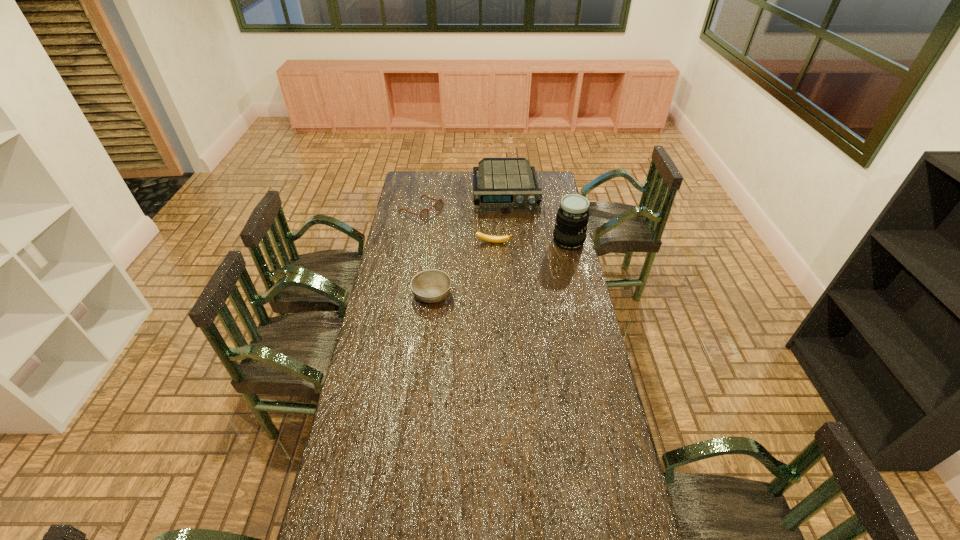
At what (x,y) coordinates should I click in order to perform the action: click on telephoto lens present at the right edge. Please return your answer as a coordinate pair (x, y). The height and width of the screenshot is (540, 960). Looking at the image, I should click on (572, 218).

You are a GUI agent. You are given a task and a screenshot of the screen. Output one action in this format:
    pyautogui.click(x=<x>, y=<y>)
    Task: Click on the radio receiver that is at the right edge
    This screenshot has width=960, height=540.
    Given the screenshot: What is the action you would take?
    pyautogui.click(x=506, y=185)

Find the location of a particular element. The height and width of the screenshot is (540, 960). object that is at the far right corner is located at coordinates (506, 185).

Find the location of `free space at the left edge`. free space at the left edge is located at coordinates (423, 230).

Image resolution: width=960 pixels, height=540 pixels. In the image, there is a desktop. In order to click on vacant space at the right edge in this screenshot , I will do `click(591, 384)`.

You are a GUI agent. You are given a task and a screenshot of the screen. Output one action in this format:
    pyautogui.click(x=<x>, y=<y>)
    Task: Click on the blank space at the far left corner of the desktop
    The image size is (960, 540).
    Given the screenshot: What is the action you would take?
    pyautogui.click(x=408, y=176)

Find the location of a particular element. The image size is (960, 540). blank space at the far right corner of the desktop is located at coordinates (553, 183).

In order to click on free region at the near right corner in this screenshot , I will do `click(612, 523)`.

Where is `empty location between the radio receiver and the bowl`? The width and height of the screenshot is (960, 540). empty location between the radio receiver and the bowl is located at coordinates (468, 244).

Where is `empty location between the banana and the spectacles`? This screenshot has width=960, height=540. empty location between the banana and the spectacles is located at coordinates (457, 227).